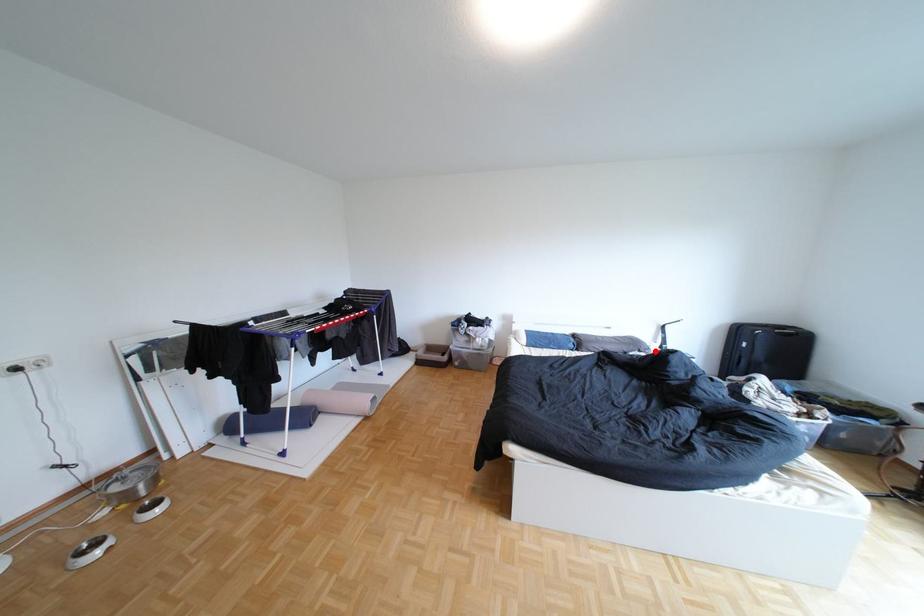
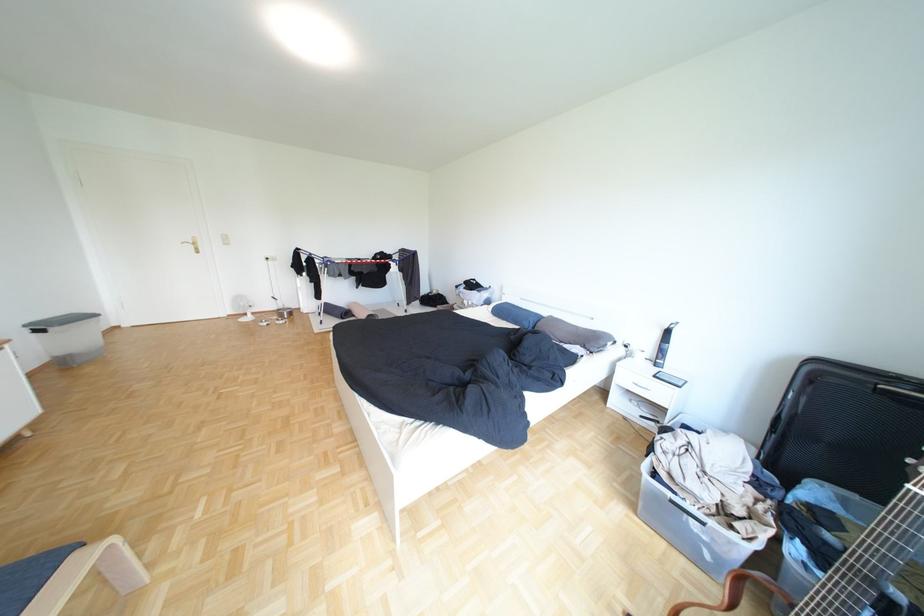
The point at the highlighted location is marked in the first image. Where is the corresponding point in the second image?

(600, 347)